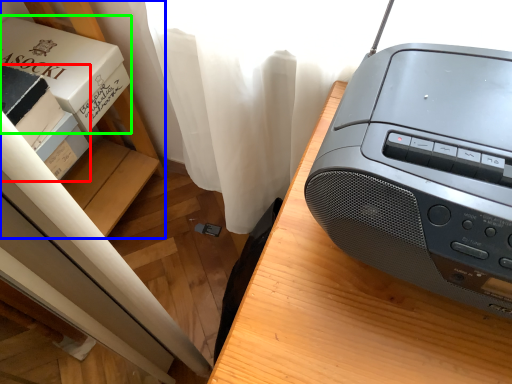
Question: Based on their relative distances, which object is nearer to box (highlighted by a red box)? Choose from shelf (highlighted by a blue box) and paperback book (highlighted by a green box).

Choices:
 (A) shelf
 (B) paperback book

Answer: (B)